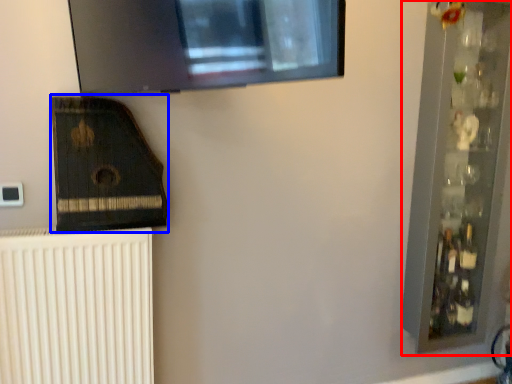
Question: Which object appears closest to the camera in this image, shelf (highlighted by a red box) or amplifier (highlighted by a blue box)?

Choices:
 (A) shelf
 (B) amplifier

Answer: (B)